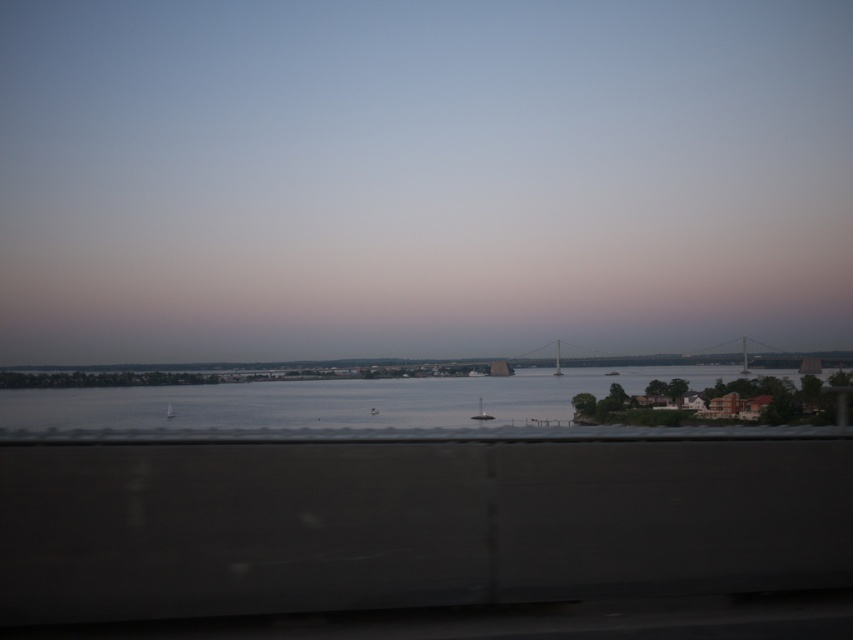
You are standing on the deck of a boat in the middle of the water. You see the clear water at center and the metallic gray bridge at center. Which object appears taller from your perspective?

The clear water at center appears taller than the metallic gray bridge at center because the clear water at center has a greater height compared to metallic gray bridge at center.